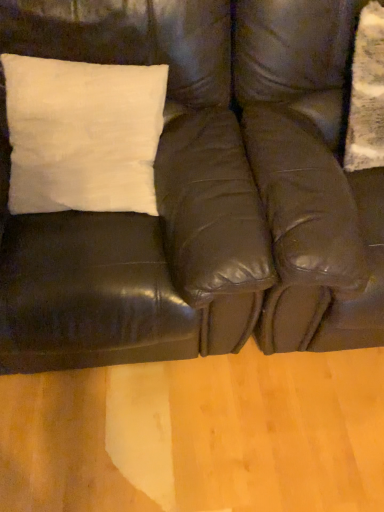
Question: Choose the correct answer: Is matte black leather couch at upper left inside matte black swivel chair at right or outside it?

Choices:
 (A) outside
 (B) inside

Answer: (A)

Question: In terms of size, does matte black leather couch at upper left appear bigger or smaller than matte black swivel chair at right?

Choices:
 (A) big
 (B) small

Answer: (A)

Question: From the image's perspective, relative to matte black swivel chair at right, is matte black leather couch at upper left above or below?

Choices:
 (A) above
 (B) below

Answer: (B)

Question: In the image, is matte black swivel chair at right on the left side or the right side of matte black leather couch at upper left?

Choices:
 (A) left
 (B) right

Answer: (B)

Question: Is point (264, 15) closer or farther from the camera than point (261, 98)?

Choices:
 (A) closer
 (B) farther

Answer: (A)

Question: In terms of size, does matte black swivel chair at right appear bigger or smaller than matte black leather couch at upper left?

Choices:
 (A) small
 (B) big

Answer: (A)

Question: From a real-world perspective, is matte black swivel chair at right positioned above or below matte black leather couch at upper left?

Choices:
 (A) above
 (B) below

Answer: (B)